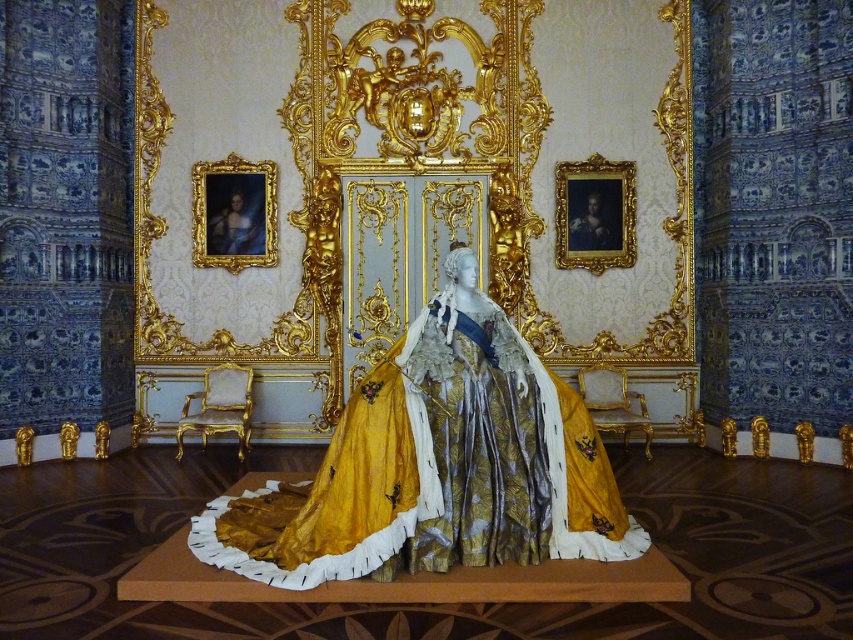
Question: Based on their relative distances, which object is farther from the gold satin gown at center?

Choices:
 (A) gold ornate frame at upper left
 (B) gold ornate frame at upper right

Answer: (B)

Question: Which object is farther from the camera taking this photo?

Choices:
 (A) gold ornate frame at upper right
 (B) gold ornate frame at upper left

Answer: (B)

Question: Does gold satin gown at center have a larger size compared to gold ornate frame at upper left?

Choices:
 (A) yes
 (B) no

Answer: (A)

Question: Is gold satin gown at center smaller than gold ornate frame at upper left?

Choices:
 (A) yes
 (B) no

Answer: (B)

Question: Which object appears closest to the camera in this image?

Choices:
 (A) gold satin gown at center
 (B) gold ornate frame at upper left

Answer: (A)

Question: Where is gold satin gown at center located in relation to gold ornate frame at upper right in the image?

Choices:
 (A) above
 (B) below

Answer: (B)